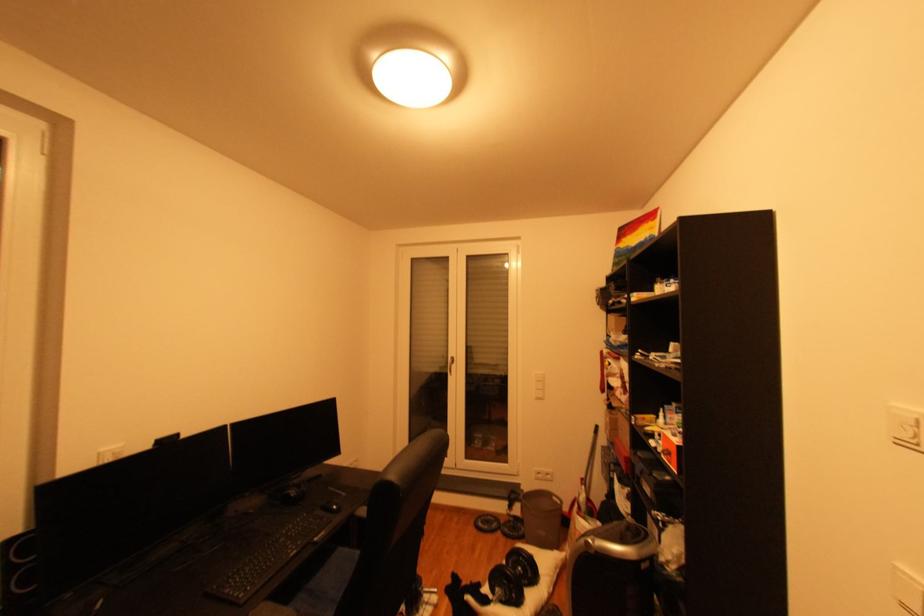
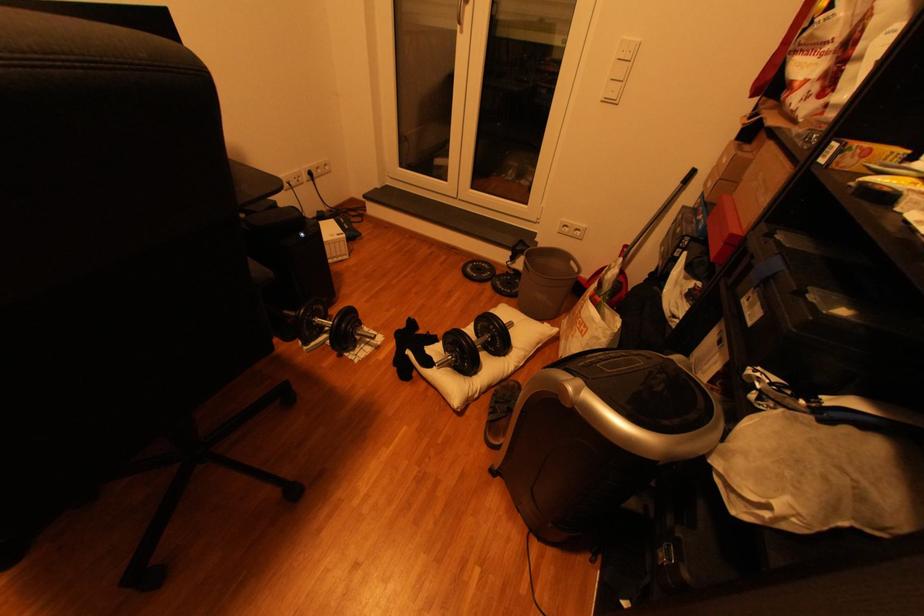
In the second image, find the point that corresponds to [527,535] in the first image.

(518, 292)